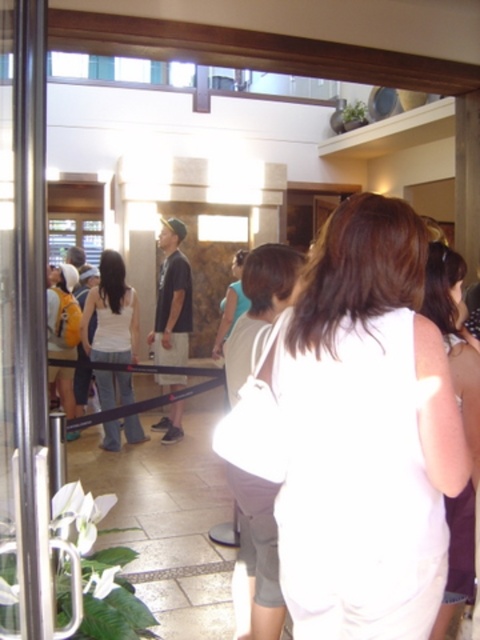
Is point (297, 253) more distant than point (55, 284)?

No, (297, 253) is in front of (55, 284).

Is the position of light gray fabric pants at center more distant than that of yellow backpack at left?

No, it is in front of yellow backpack at left.

Is point (266, 557) closer to camera compared to point (64, 304)?

Yes, it is.

Locate an element on the screen. The image size is (480, 640). light gray fabric pants at center is located at coordinates (259, 308).

Measure the distance from white fabric shirt at center to yellow backpack at left.

white fabric shirt at center and yellow backpack at left are 16.27 feet apart.

Who is more distant from viewer, (x=302, y=570) or (x=63, y=403)?

The point (x=63, y=403) is more distant.

Describe the element at coordinates (354, 433) in the screenshot. I see `white fabric shirt at center` at that location.

I want to click on white fabric shirt at center, so click(x=354, y=433).

Between transparent glass door at left and light gray fabric pants at center, which one appears on the right side from the viewer's perspective?

light gray fabric pants at center is more to the right.

You are a GUI agent. You are given a task and a screenshot of the screen. Output one action in this format:
    pyautogui.click(x=<x>, y=<y>)
    Task: Click on the transparent glass door at left
    The image size is (480, 640).
    Given the screenshot: What is the action you would take?
    pyautogui.click(x=26, y=333)